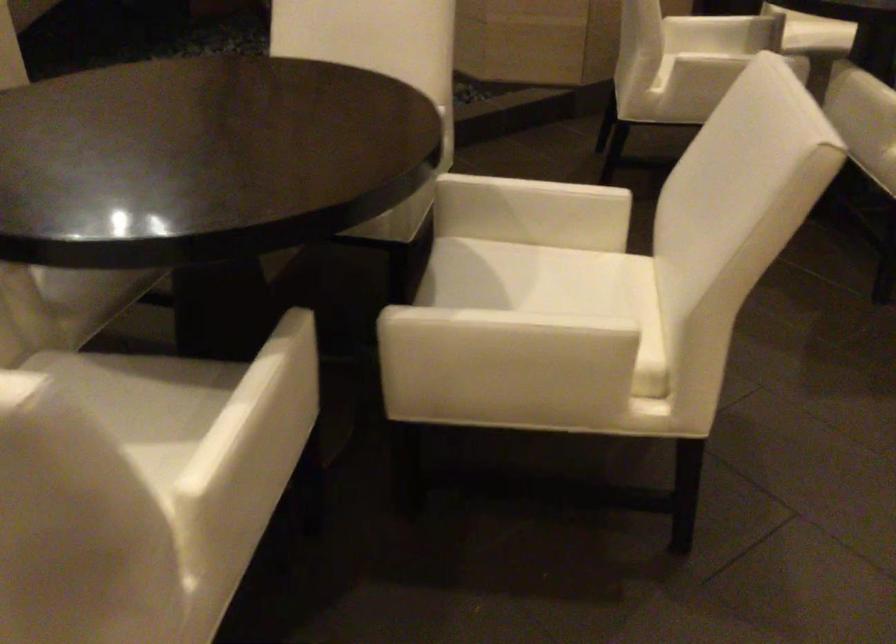
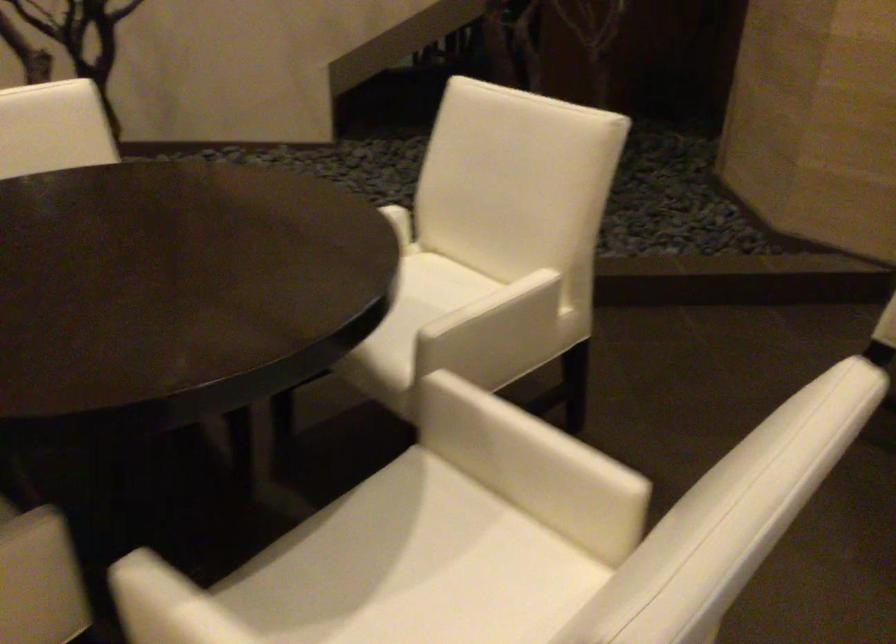
Question: Based on the continuous images, in which direction is the camera rotating? Reply with the corresponding letter.

Choices:
 (A) Left
 (B) Right
 (C) Up
 (D) Down

Answer: (A)